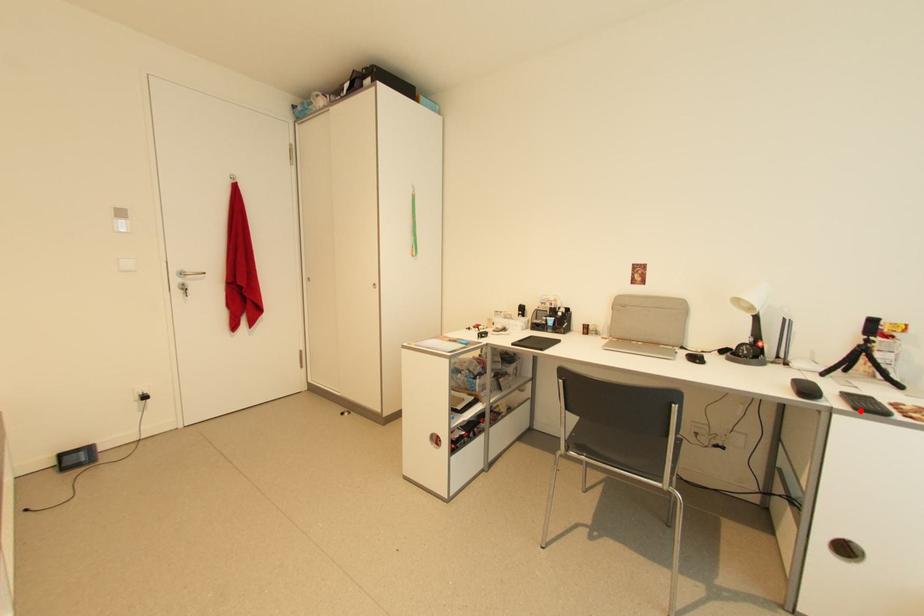
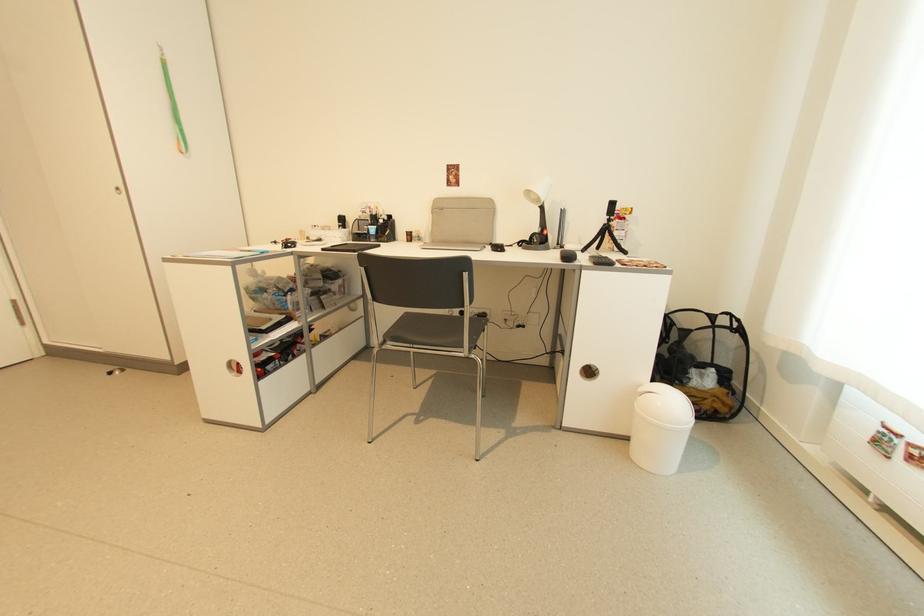
The point at the highlighted location is marked in the first image. Where is the corresponding point in the second image?

(600, 265)